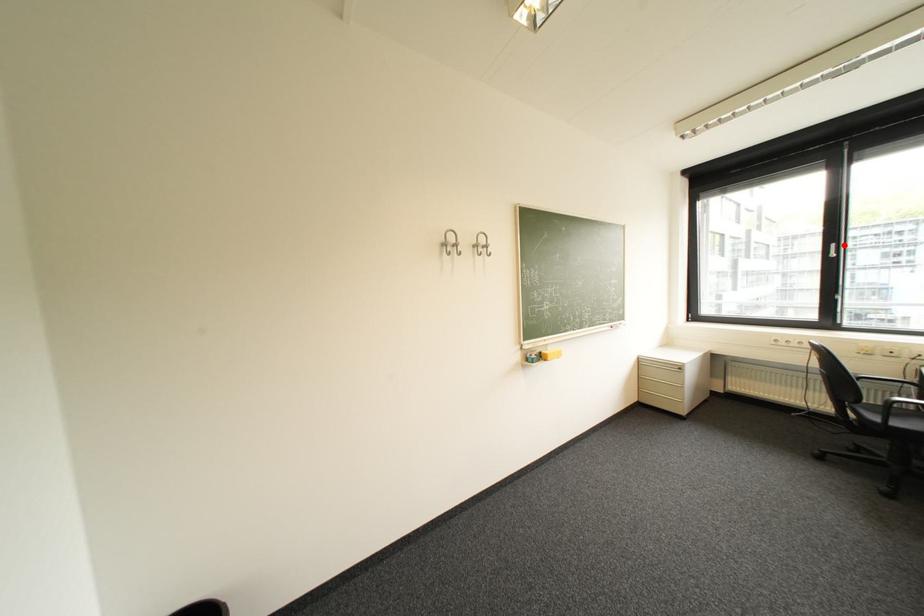
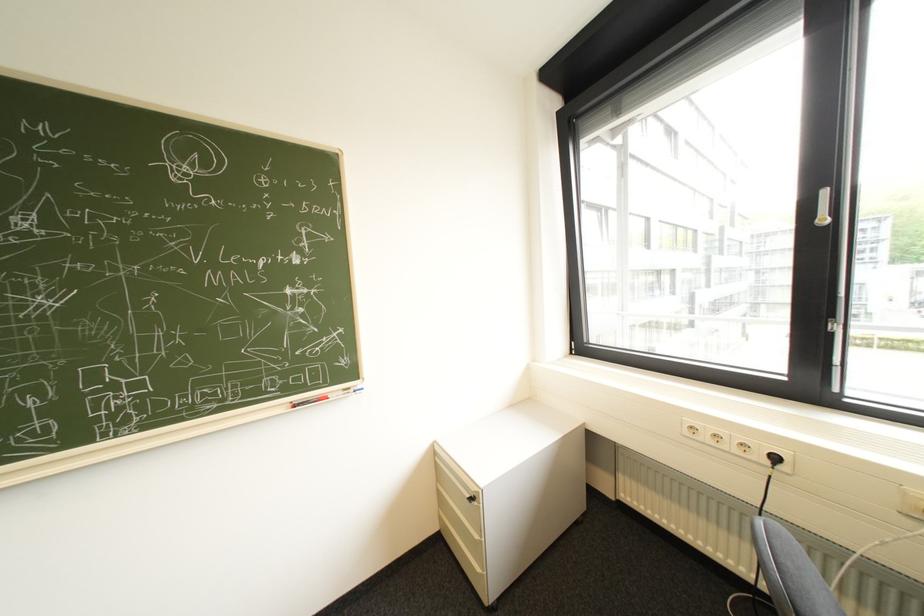
Find the pixel in the second image that matches the highlighted location in the first image.

(834, 193)